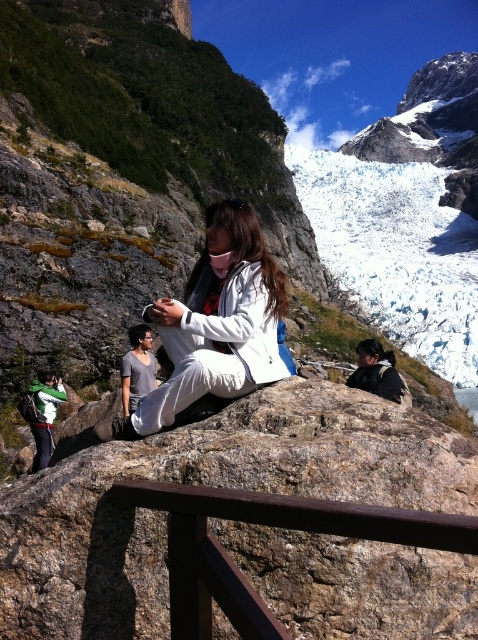
You are a photographer standing on the brown rough rock at center and want to take a photo of the glacier. To avoid the brown wood rail at center from blocking your view, should you move forward or backward on the rock?

The brown rough rock at center is further to the viewer than brown wood rail at center. Therefore, to avoid the brown wood rail at center blocking your view, you should move forward on the rock to get a clearer shot of the glacier.

You are standing at the hiking trail and see the brown rough rock at center and the matte black jacket at center. Which object is positioned more to the left side from your viewpoint?

The brown rough rock at center is positioned to the left of the matte black jacket at center, so it is more to the left side from your viewpoint.